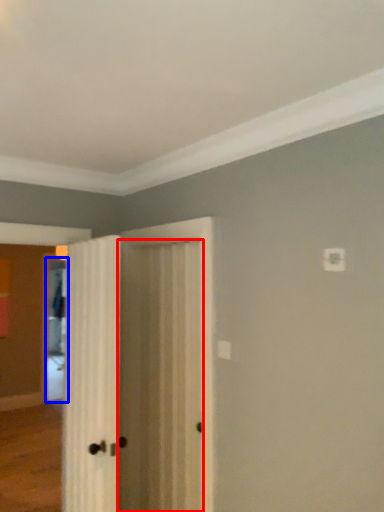
Question: Which of the following is the farthest to the observer, door (highlighted by a red box) or screen door (highlighted by a blue box)?

Choices:
 (A) door
 (B) screen door

Answer: (B)